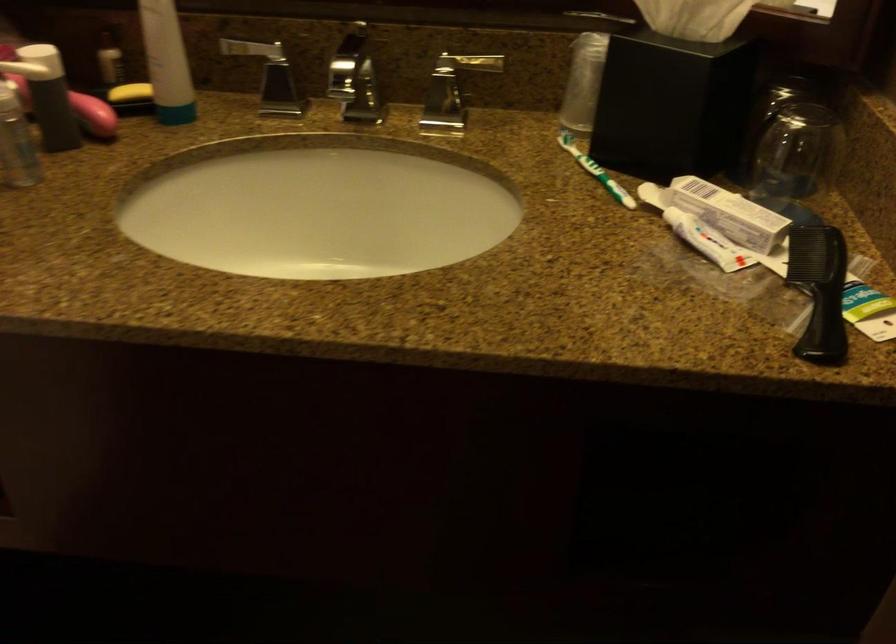
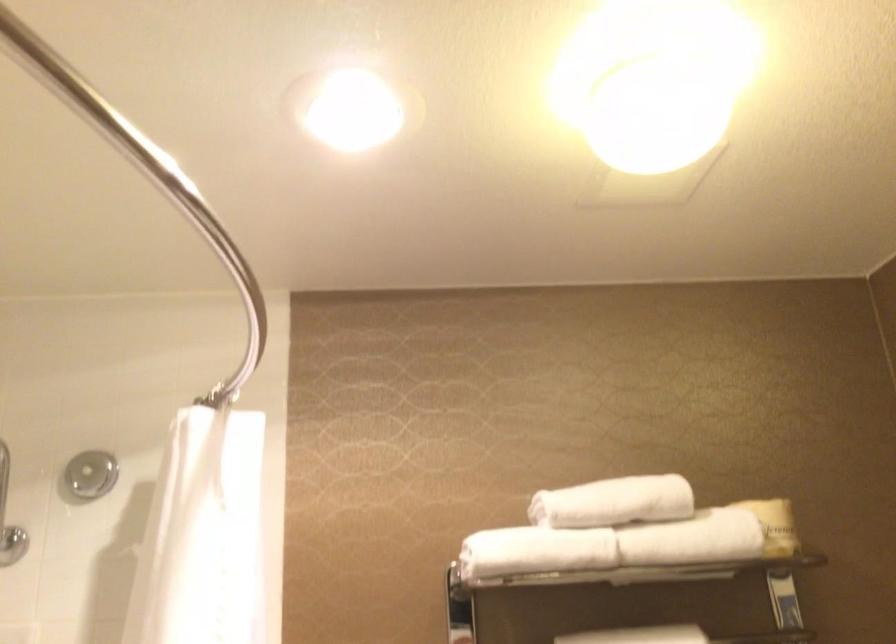
How did the camera likely rotate?

The camera rotated toward left-up.